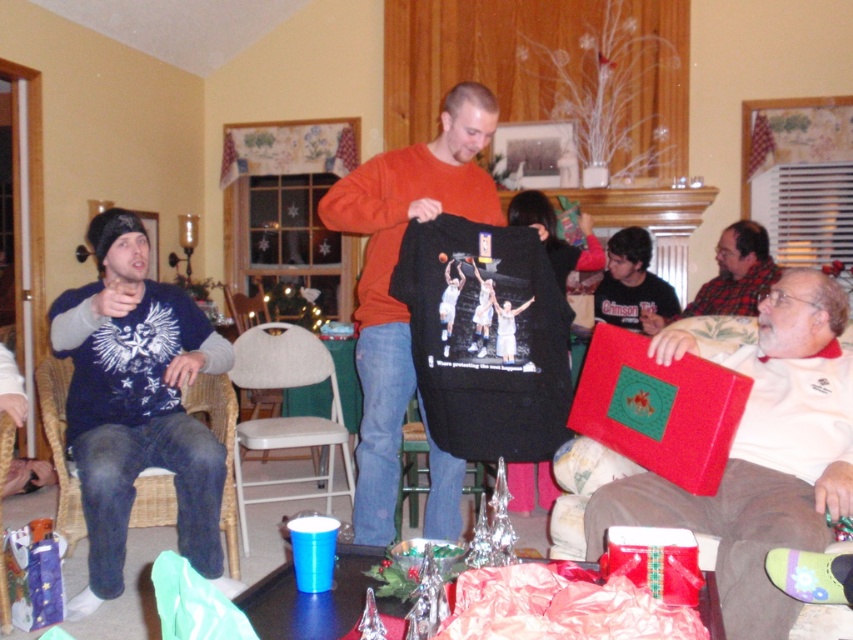
You are standing in the room and want to hand the white cotton shirt at lower right to someone. Where should you look to find it?

The white cotton shirt at lower right is located at the 2D coordinates point (759, 452).

You are hosting a holiday party and need to place a 3.5 feet wide rectangular table between the beige fabric chair at center and the wooden woven armchair at lower left. Will there be enough space to fit the table between them?

The beige fabric chair at center and wooden woven armchair at lower left are 3.81 feet apart. Since the table is 3.5 feet wide, it will fit as the distance between the chairs is slightly larger than the table width.